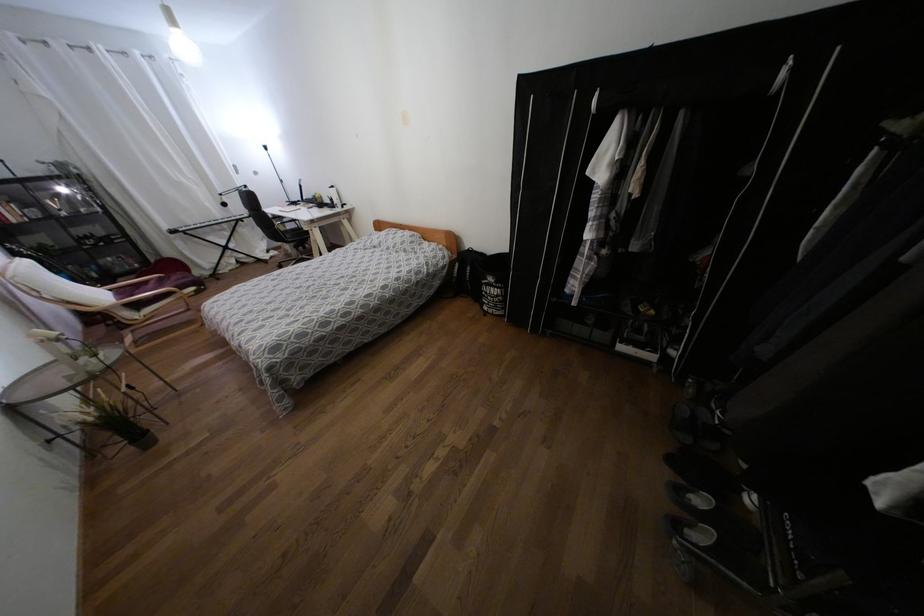
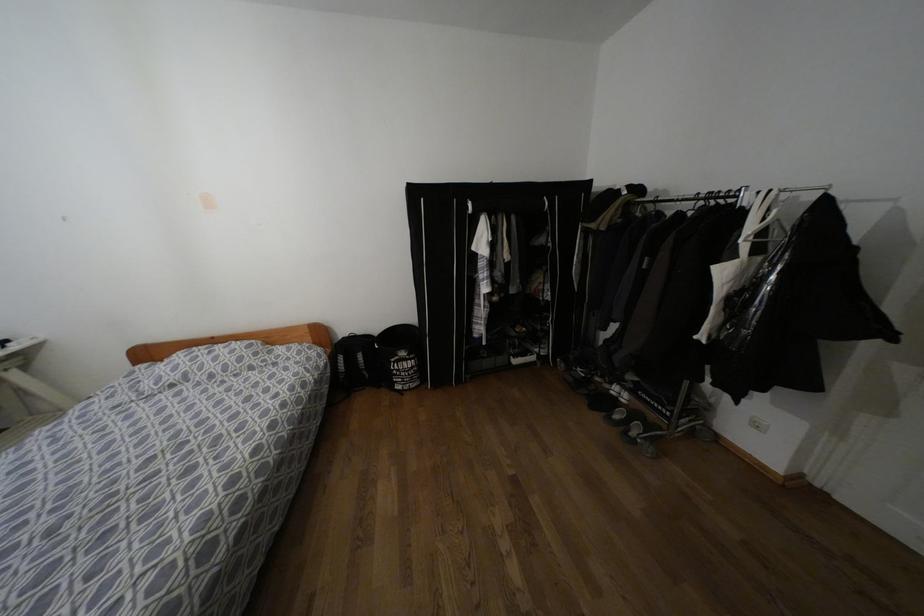
Question: The camera is either moving clockwise (left) or counter-clockwise (right) around the object. The first image is from the beginning of the video and the second image is from the end. Is the camera moving left or right when shooting the video?

Choices:
 (A) Left
 (B) Right

Answer: (A)